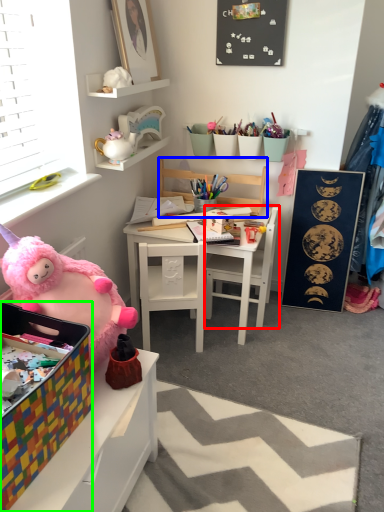
Question: Considering the real-world distances, which object is closest to chair (highlighted by a red box)? chair (highlighted by a blue box) or box (highlighted by a green box).

Choices:
 (A) chair
 (B) box

Answer: (A)